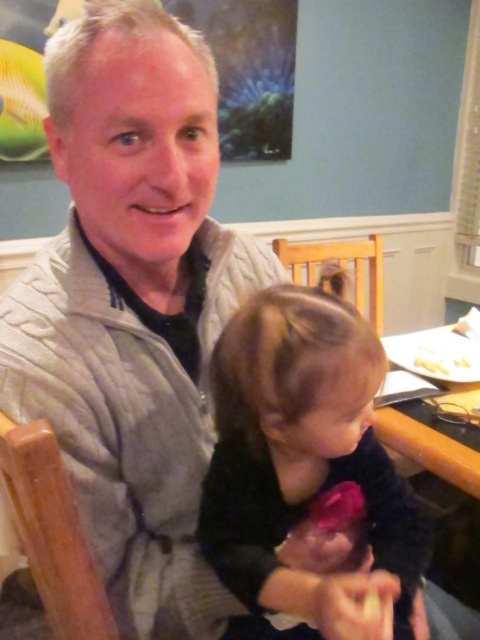
Question: Is wooden table at center smaller than white matte plate at upper right?

Choices:
 (A) yes
 (B) no

Answer: (B)

Question: Which point is farther to the camera?

Choices:
 (A) (460, 356)
 (B) (448, 465)

Answer: (A)

Question: Is wooden table at center closer to camera compared to white matte plate at upper right?

Choices:
 (A) yes
 (B) no

Answer: (A)

Question: Which point is closer to the camera?

Choices:
 (A) white matte plate at upper right
 (B) wooden table at center

Answer: (B)

Question: Does wooden table at center appear over white matte plate at upper right?

Choices:
 (A) no
 (B) yes

Answer: (A)